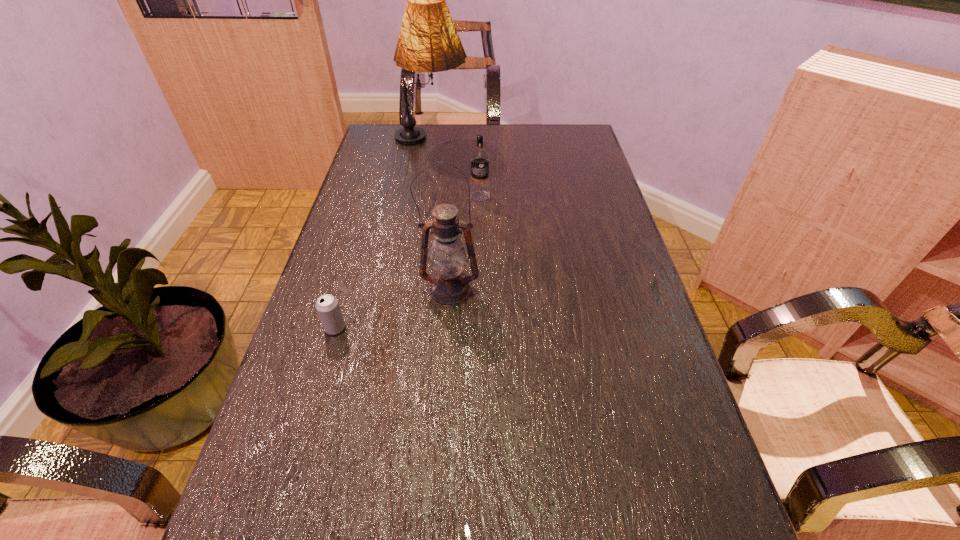
At what (x,y) coordinates should I click in order to perform the action: click on vacant space in between the fourth farthest object and the oil lamp. Please return your answer as a coordinate pair (x, y). The image size is (960, 540). Looking at the image, I should click on (393, 309).

Locate an element on the screen. This screenshot has height=540, width=960. unoccupied area between the oil lamp and the fourth farthest object is located at coordinates (393, 309).

The height and width of the screenshot is (540, 960). Identify the location of vacant area that lies between the third farthest object and the second shortest object. (393, 309).

Identify the location of free space between the farthest object and the second nearest object. (383, 235).

You are a GUI agent. You are given a task and a screenshot of the screen. Output one action in this format:
    pyautogui.click(x=<x>, y=<y>)
    Task: Click on the object that is the nearest to the farthest object
    The width and height of the screenshot is (960, 540).
    Given the screenshot: What is the action you would take?
    pyautogui.click(x=479, y=191)

Image resolution: width=960 pixels, height=540 pixels. What are the coordinates of `object that stands as the second closest to the nearest object` in the screenshot? It's located at (449, 287).

Where is `vacant point that satisfies the following two spatial constraints: 1. on the front-facing side of the tallest object; 2. on the left side of the oil lamp`? Image resolution: width=960 pixels, height=540 pixels. vacant point that satisfies the following two spatial constraints: 1. on the front-facing side of the tallest object; 2. on the left side of the oil lamp is located at coordinates (407, 292).

I want to click on vacant space that satisfies the following two spatial constraints: 1. on the front-facing side of the farthest object; 2. on the back side of the fourth shortest object, so click(x=407, y=292).

Find the location of a particular element. The image size is (960, 540). vacant region that satisfies the following two spatial constraints: 1. on the front-facing side of the second tallest object; 2. on the right side of the tallest object is located at coordinates (407, 292).

Where is `vacant area that satisfies the following two spatial constraints: 1. on the back side of the oil lamp; 2. on the front-facing side of the farthest object`? The width and height of the screenshot is (960, 540). vacant area that satisfies the following two spatial constraints: 1. on the back side of the oil lamp; 2. on the front-facing side of the farthest object is located at coordinates (460, 141).